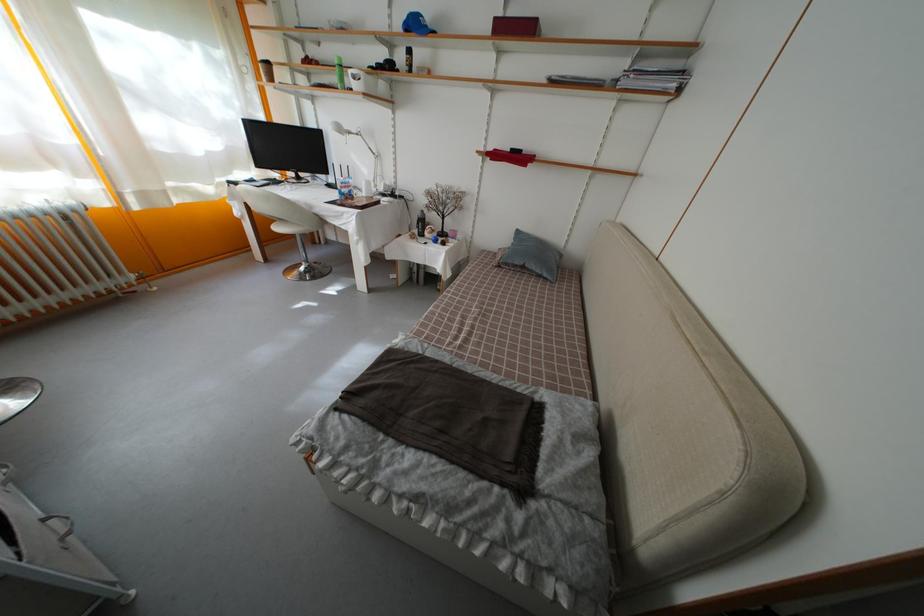
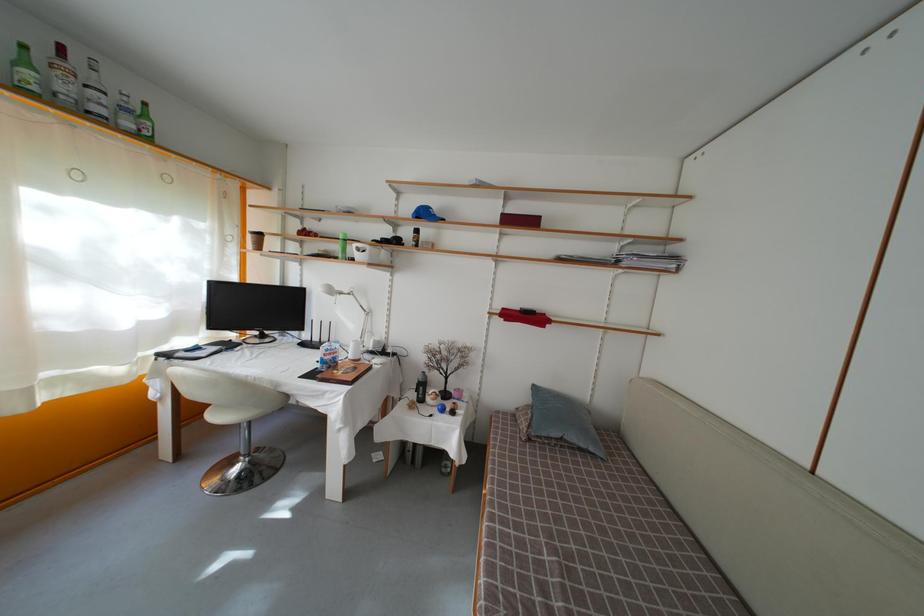
In a continuous first-person perspective shot, in which direction is the camera moving?

The movement direction of the cameraman is left, forward.